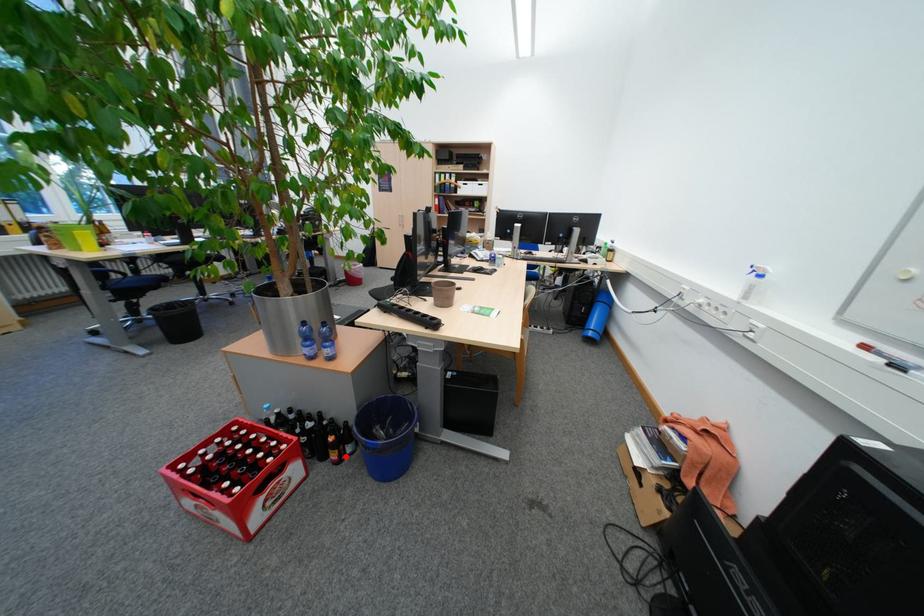
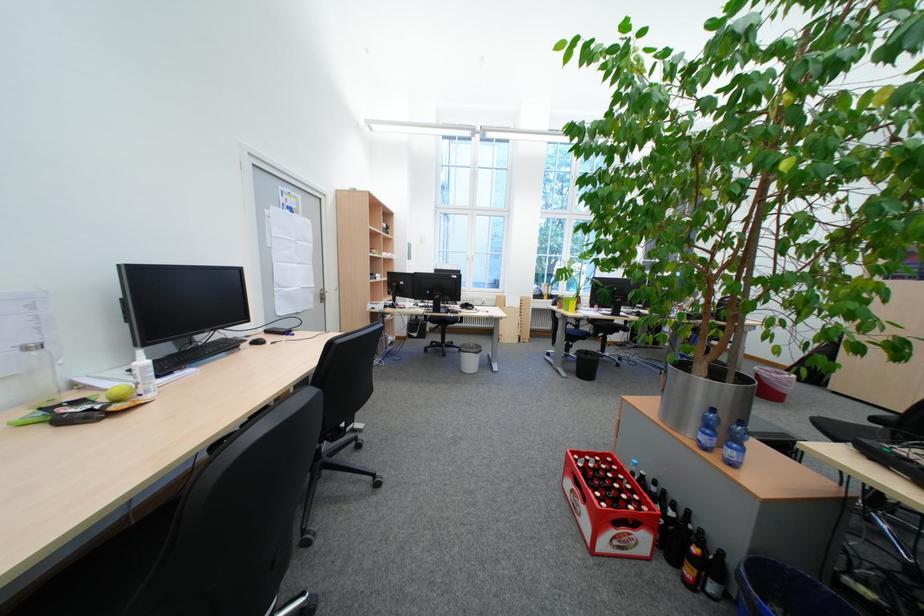
Question: I am providing you with two images of the same scene from different viewpoints. In image1, a red point is highlighted. Considering the same 3D point in image2, which of the following is correct?

Choices:
 (A) It is closer
 (B) It is farther

Answer: (A)